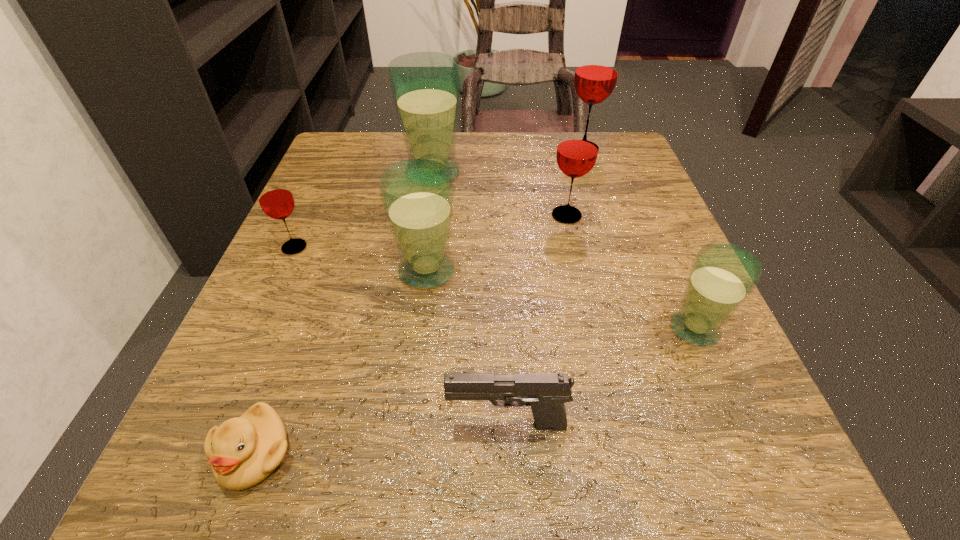
Identify the location of yellow duckling. (243, 451).

Locate an element on the screen. The height and width of the screenshot is (540, 960). duckling is located at coordinates (243, 451).

Identify the location of vacant position located on the left of the farthest red glass. pyautogui.click(x=490, y=150).

What are the coordinates of `vacant space located on the back of the farthest blue glass` in the screenshot? It's located at 438,137.

At what (x,y) coordinates should I click in order to perform the action: click on vacant space positioned 0.170m on the front of the second biggest red glass. Please return your answer as a coordinate pair (x, y). This screenshot has width=960, height=540. Looking at the image, I should click on (585, 294).

Identify the location of vacant region located 0.140m on the front of the second farthest blue glass. The image size is (960, 540). (415, 370).

This screenshot has width=960, height=540. In order to click on vacant point located on the front of the smallest red glass in this screenshot , I will do `click(212, 429)`.

Identify the location of vacant space located on the left of the third nearest object. (456, 329).

Identify the location of vacant space located aim along the barrel of the pistol. (294, 424).

You are a GUI agent. You are given a task and a screenshot of the screen. Output one action in this format:
    pyautogui.click(x=<x>, y=<y>)
    Task: Click on the blank space located aim along the barrel of the pistol
    The height and width of the screenshot is (540, 960).
    Given the screenshot: What is the action you would take?
    pyautogui.click(x=334, y=424)